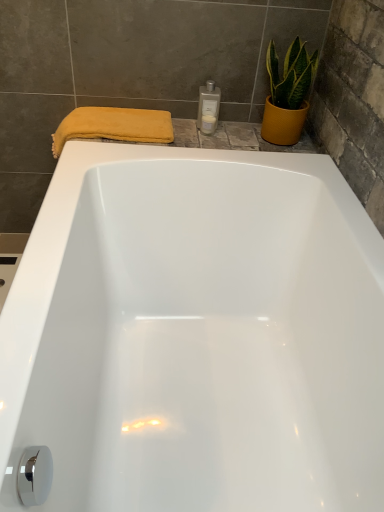
Where is `free space to the left of yellow textured pot at upper right`? This screenshot has width=384, height=512. free space to the left of yellow textured pot at upper right is located at coordinates (233, 136).